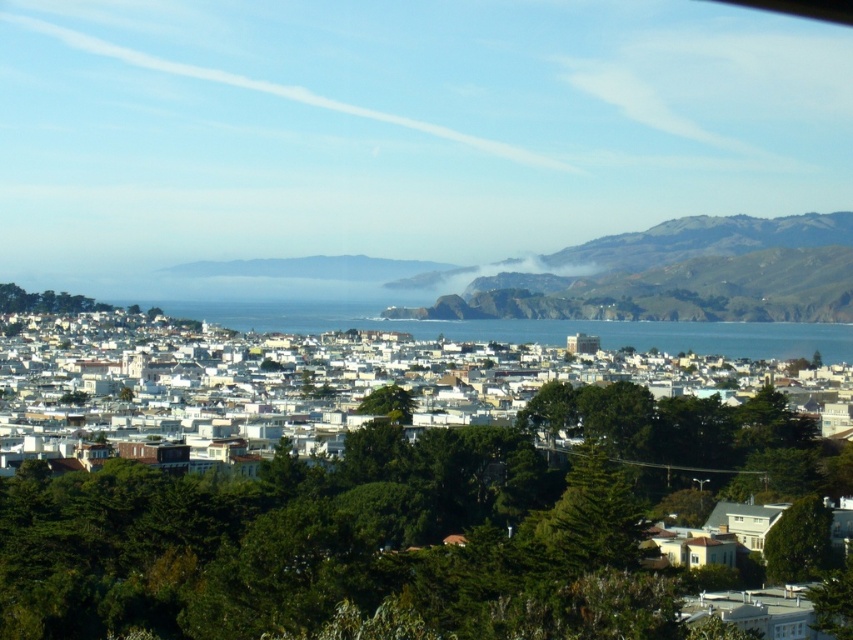
Is white matte buildings at center to the left of blue water at center from the viewer's perspective?

Yes, white matte buildings at center is to the left of blue water at center.

Who is more distant from viewer, (97, 346) or (697, 328)?

Positioned behind is point (97, 346).

The image size is (853, 640). Identify the location of white matte buildings at center. (389, 387).